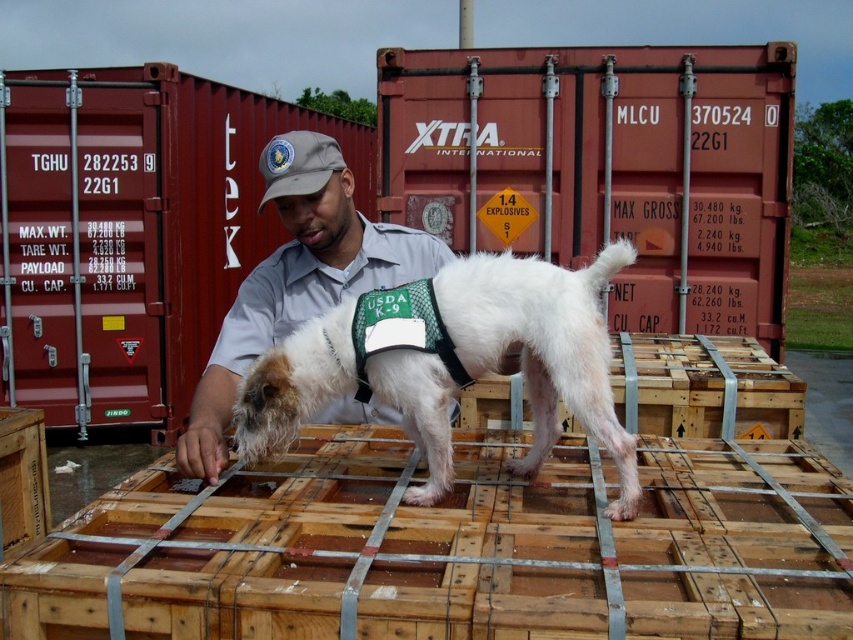
Question: Does maroon metal shipping container at center lie behind gray uniform at center?

Choices:
 (A) yes
 (B) no

Answer: (A)

Question: Among these objects, which one is farthest from the camera?

Choices:
 (A) white fur dog at center
 (B) gray uniform at center

Answer: (B)

Question: In this image, where is maroon metal shipping container at center located relative to white fur dog at center?

Choices:
 (A) left
 (B) right

Answer: (A)

Question: Which object is the closest to the white fur dog at center?

Choices:
 (A) gray uniform at center
 (B) maroon metal shipping container at center
 (C) red metal shipping container at center

Answer: (A)

Question: Does maroon metal shipping container at center have a greater width compared to gray uniform at center?

Choices:
 (A) yes
 (B) no

Answer: (A)

Question: Which object is the farthest from the white fur dog at center?

Choices:
 (A) gray uniform at center
 (B) maroon metal shipping container at center
 (C) red metal shipping container at center

Answer: (B)